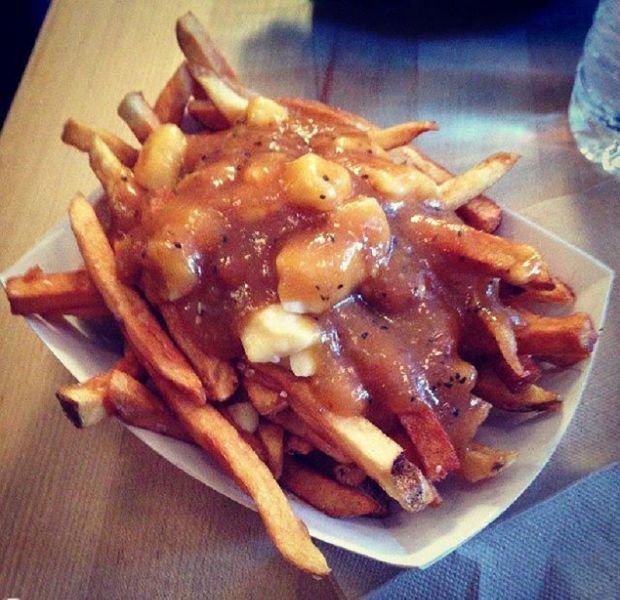
I want to click on blue-grey napkin, so click(576, 561).